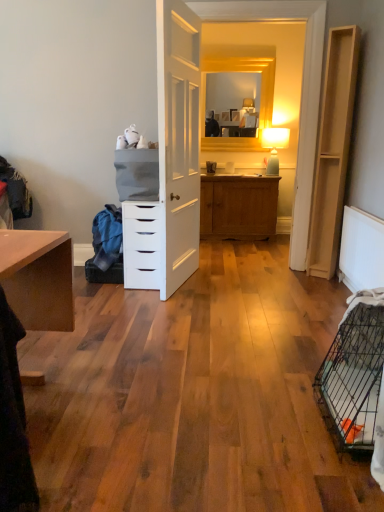
In order to click on spots to the right of white matte chest of drawers at center in this screenshot , I will do `click(209, 285)`.